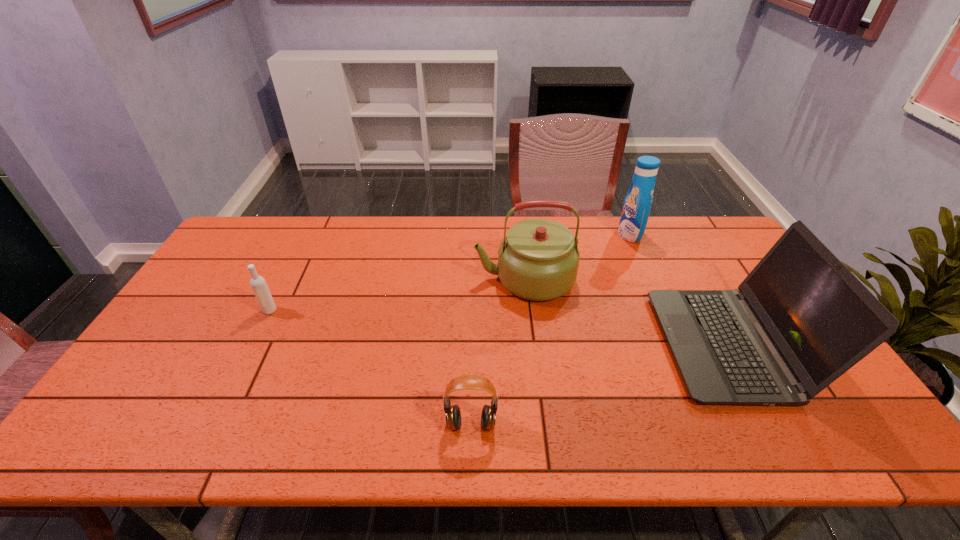
Find the location of a particular element. The height and width of the screenshot is (540, 960). the farthest object is located at coordinates (637, 205).

Identify the location of kettle. (538, 260).

The height and width of the screenshot is (540, 960). Find the location of `laptop_computer`. laptop_computer is located at coordinates (801, 319).

What are the coordinates of `the leftmost object` in the screenshot? It's located at (258, 284).

Locate an element on the screen. Image resolution: width=960 pixels, height=540 pixels. the nearest object is located at coordinates (467, 381).

Locate an element on the screen. The width and height of the screenshot is (960, 540). free location located on the front-facing side of the farthest object is located at coordinates click(510, 234).

What are the coordinates of `vacant space positioned 0.360m on the front-facing side of the farthest object` in the screenshot? It's located at (518, 234).

Where is `vacant space located 0.260m on the front-facing side of the farthest object`? The height and width of the screenshot is (540, 960). vacant space located 0.260m on the front-facing side of the farthest object is located at coordinates (546, 234).

Find the location of a particular element. vacant area situated at the spout of the kettle is located at coordinates (385, 279).

This screenshot has height=540, width=960. I want to click on vacant region located 0.320m at the spout of the kettle, so click(372, 279).